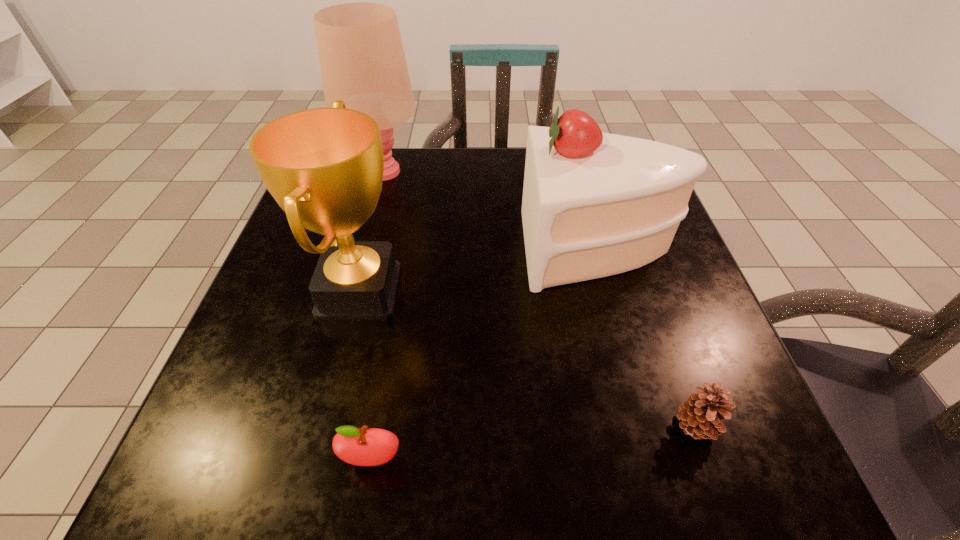
Locate an element on the screen. This screenshot has width=960, height=540. object positioned at the far edge is located at coordinates (362, 61).

Locate an element on the screen. This screenshot has width=960, height=540. apple positioned at the near edge is located at coordinates (362, 447).

Where is `pinecone present at the near edge`? The image size is (960, 540). pinecone present at the near edge is located at coordinates (701, 414).

Locate an element on the screen. The width and height of the screenshot is (960, 540). lampshade present at the left edge is located at coordinates (362, 61).

At what (x,y) coordinates should I click in order to perform the action: click on award located in the left edge section of the desktop. Please return your answer as a coordinate pair (x, y). Looking at the image, I should click on (324, 167).

You are a GUI agent. You are given a task and a screenshot of the screen. Output one action in this format:
    pyautogui.click(x=<x>, y=<y>)
    Task: Click on the cake present at the right edge
    The image size is (960, 540).
    Given the screenshot: What is the action you would take?
    pyautogui.click(x=594, y=204)

The height and width of the screenshot is (540, 960). I want to click on pinecone present at the right edge, so click(x=701, y=414).

You are a GUI agent. You are given a task and a screenshot of the screen. Output one action in this format:
    pyautogui.click(x=<x>, y=<y>)
    Task: Click on the object present at the far left corner
    The image size is (960, 540).
    Given the screenshot: What is the action you would take?
    pyautogui.click(x=362, y=61)

Where is `object that is at the near right corner`? Image resolution: width=960 pixels, height=540 pixels. object that is at the near right corner is located at coordinates (701, 414).

The image size is (960, 540). Find the location of `free space at the far edge`. free space at the far edge is located at coordinates (451, 190).